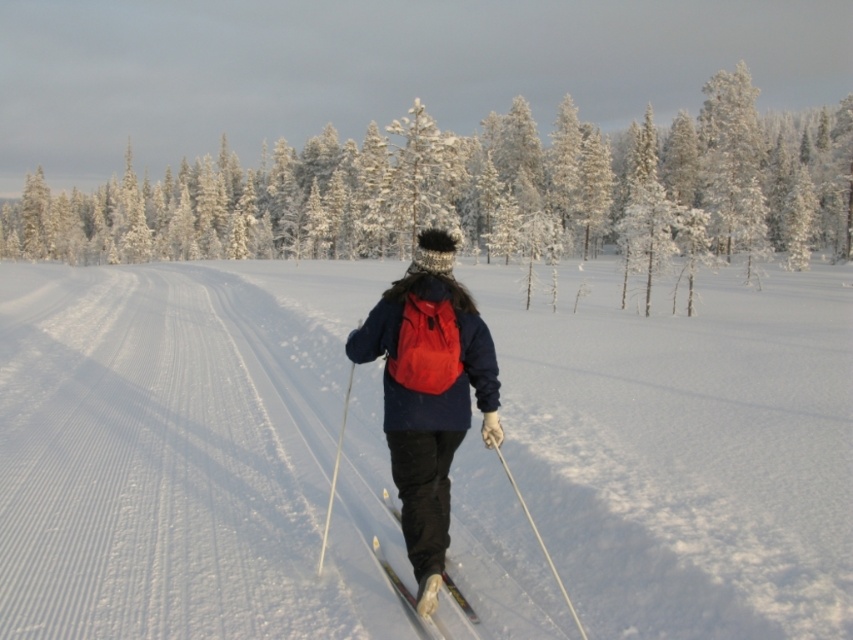
I want to click on matte blue jacket at center, so click(x=428, y=394).

Describe the element at coordinates (428, 394) in the screenshot. I see `matte blue jacket at center` at that location.

Image resolution: width=853 pixels, height=640 pixels. Identify the location of matte blue jacket at center. (428, 394).

Does white snow-covered tree at center appear over white plastic ski pole at lower center?

Indeed, white snow-covered tree at center is positioned over white plastic ski pole at lower center.

Image resolution: width=853 pixels, height=640 pixels. Describe the element at coordinates (471, 189) in the screenshot. I see `white snow-covered tree at center` at that location.

At what (x,y) coordinates should I click in order to perform the action: click on white snow-covered tree at center. Please return your answer as a coordinate pair (x, y). Image resolution: width=853 pixels, height=640 pixels. Looking at the image, I should click on (471, 189).

Which is more to the right, white snow-covered tree at center or shiny metallic ski at center?

From the viewer's perspective, shiny metallic ski at center appears more on the right side.

How distant is white snow-covered tree at center from shiny metallic ski at center?

white snow-covered tree at center is 92.00 meters from shiny metallic ski at center.

What are the coordinates of `white snow-covered tree at center` in the screenshot? It's located at (471, 189).